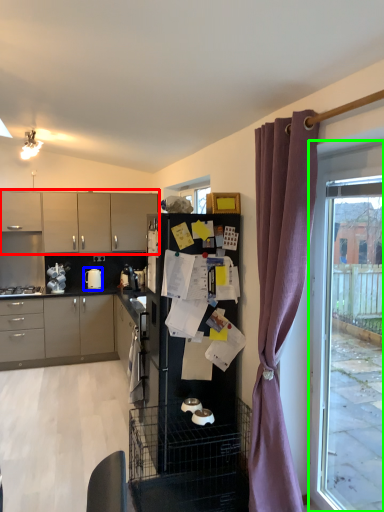
Question: Based on their relative distances, which object is farther from cabinetry (highlighted by a red box)? Choose from kitchen appliance (highlighted by a blue box) and window (highlighted by a green box).

Choices:
 (A) kitchen appliance
 (B) window

Answer: (B)